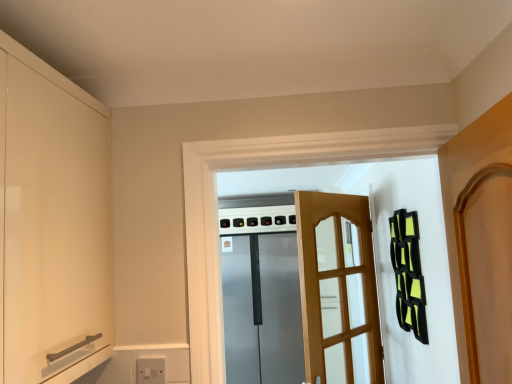
Where is `satin silver refrigerator at center, marked as the 1th screen door in a back-to-front arrangement`? The width and height of the screenshot is (512, 384). satin silver refrigerator at center, marked as the 1th screen door in a back-to-front arrangement is located at coordinates [x=262, y=310].

Locate an element on the screen. light brown wooden screen door at center, which is the second screen door from back to front is located at coordinates [343, 301].

Does matte white cabinet at left have a greater height compared to light brown wooden screen door at center, which is the second screen door from back to front?

No, matte white cabinet at left is not taller than light brown wooden screen door at center, which is the second screen door from back to front.

From the image's perspective, is matte white cabinet at left positioned above or below light brown wooden screen door at center, which is the second screen door from back to front?

Based on their image positions, matte white cabinet at left is located above light brown wooden screen door at center, which is the second screen door from back to front.

Considering the relative positions of matte white cabinet at left and light brown wooden screen door at center, which is the second screen door from back to front, in the image provided, is matte white cabinet at left to the right of light brown wooden screen door at center, which is the second screen door from back to front, from the viewer's perspective?

Incorrect, matte white cabinet at left is not on the right side of light brown wooden screen door at center, which is the second screen door from back to front.

Looking at this image, is matte white cabinet at left thinner than light brown wooden screen door at center, which is counted as the 1th screen door, starting from the front?

No.

How distant is satin silver refrigerator at center, the 2th screen door viewed from the front, from matte white cabinet at left?

A distance of 3.21 meters exists between satin silver refrigerator at center, the 2th screen door viewed from the front, and matte white cabinet at left.

Considering the points (257, 301) and (12, 179), which point is in front, point (257, 301) or point (12, 179)?

The point (12, 179) is closer to the camera.

Is satin silver refrigerator at center, marked as the 1th screen door in a back-to-front arrangement, not near matte white cabinet at left?

That's right, there is a large distance between satin silver refrigerator at center, marked as the 1th screen door in a back-to-front arrangement, and matte white cabinet at left.

Between satin silver refrigerator at center, marked as the 1th screen door in a back-to-front arrangement, and matte white cabinet at left, which one is positioned behind?

satin silver refrigerator at center, marked as the 1th screen door in a back-to-front arrangement, is further away from the camera.

Who is bigger, satin silver refrigerator at center, marked as the 1th screen door in a back-to-front arrangement, or light brown wooden screen door at center, which is counted as the 1th screen door, starting from the front?

satin silver refrigerator at center, marked as the 1th screen door in a back-to-front arrangement.

Which object is closer to the camera, satin silver refrigerator at center, the 2th screen door viewed from the front, or light brown wooden screen door at center, which is counted as the 1th screen door, starting from the front?

light brown wooden screen door at center, which is counted as the 1th screen door, starting from the front.

From the image's perspective, who appears lower, satin silver refrigerator at center, the 2th screen door viewed from the front, or light brown wooden screen door at center, which is counted as the 1th screen door, starting from the front?

satin silver refrigerator at center, the 2th screen door viewed from the front, from the image's perspective.

Considering the relative positions of light brown wooden screen door at center, which is counted as the 1th screen door, starting from the front, and matte white cabinet at left in the image provided, is light brown wooden screen door at center, which is counted as the 1th screen door, starting from the front, to the right of matte white cabinet at left from the viewer's perspective?

Indeed, light brown wooden screen door at center, which is counted as the 1th screen door, starting from the front, is positioned on the right side of matte white cabinet at left.

From the image's perspective, is light brown wooden screen door at center, which is counted as the 1th screen door, starting from the front, positioned above or below matte white cabinet at left?

From the image's perspective, light brown wooden screen door at center, which is counted as the 1th screen door, starting from the front, appears below matte white cabinet at left.

Measure the distance between light brown wooden screen door at center, which is the second screen door from back to front, and matte white cabinet at left.

light brown wooden screen door at center, which is the second screen door from back to front, is 5.10 feet from matte white cabinet at left.

Are light brown wooden screen door at center, which is the second screen door from back to front, and matte white cabinet at left located far from each other?

Indeed, light brown wooden screen door at center, which is the second screen door from back to front, is not near matte white cabinet at left.

Is light brown wooden screen door at center, which is counted as the 1th screen door, starting from the front, closer to the viewer compared to satin silver refrigerator at center, marked as the 1th screen door in a back-to-front arrangement?

Yes.

How much distance is there between light brown wooden screen door at center, which is the second screen door from back to front, and satin silver refrigerator at center, the 2th screen door viewed from the front?

The distance of light brown wooden screen door at center, which is the second screen door from back to front, from satin silver refrigerator at center, the 2th screen door viewed from the front, is 5.92 feet.

From the image's perspective, which one is positioned lower, light brown wooden screen door at center, which is the second screen door from back to front, or satin silver refrigerator at center, marked as the 1th screen door in a back-to-front arrangement?

satin silver refrigerator at center, marked as the 1th screen door in a back-to-front arrangement, from the image's perspective.

Is light brown wooden screen door at center, which is the second screen door from back to front, beside satin silver refrigerator at center, marked as the 1th screen door in a back-to-front arrangement?

No, light brown wooden screen door at center, which is the second screen door from back to front, is not next to satin silver refrigerator at center, marked as the 1th screen door in a back-to-front arrangement.

This screenshot has width=512, height=384. I want to click on cabinetry that appears on the left of satin silver refrigerator at center, the 2th screen door viewed from the front, so click(52, 223).

Considering the positions of objects matte white cabinet at left and satin silver refrigerator at center, marked as the 1th screen door in a back-to-front arrangement, in the image provided, who is more to the right, matte white cabinet at left or satin silver refrigerator at center, marked as the 1th screen door in a back-to-front arrangement,?

satin silver refrigerator at center, marked as the 1th screen door in a back-to-front arrangement.

Does matte white cabinet at left touch satin silver refrigerator at center, the 2th screen door viewed from the front?

matte white cabinet at left is not next to satin silver refrigerator at center, the 2th screen door viewed from the front, and they're not touching.

This screenshot has height=384, width=512. In the image, there is a light brown wooden screen door at center, which is the second screen door from back to front. In order to click on cabinetry above it (from the image's perspective) in this screenshot , I will do `click(52, 223)`.

Where is `cabinetry in front of the satin silver refrigerator at center, the 2th screen door viewed from the front`? This screenshot has height=384, width=512. cabinetry in front of the satin silver refrigerator at center, the 2th screen door viewed from the front is located at coordinates 52,223.

Which object lies further to the anchor point light brown wooden screen door at center, which is counted as the 1th screen door, starting from the front, satin silver refrigerator at center, the 2th screen door viewed from the front, or matte white cabinet at left?

satin silver refrigerator at center, the 2th screen door viewed from the front, lies further to light brown wooden screen door at center, which is counted as the 1th screen door, starting from the front, than the other object.

Looking at this image, looking at the image, which one is located closer to satin silver refrigerator at center, the 2th screen door viewed from the front, light brown wooden screen door at center, which is the second screen door from back to front, or matte white cabinet at left?

Based on the image, light brown wooden screen door at center, which is the second screen door from back to front, appears to be nearer to satin silver refrigerator at center, the 2th screen door viewed from the front.

In the scene shown: From the image, which object appears to be nearer to matte white cabinet at left, light brown wooden screen door at center, which is counted as the 1th screen door, starting from the front, or satin silver refrigerator at center, the 2th screen door viewed from the front?

light brown wooden screen door at center, which is counted as the 1th screen door, starting from the front, lies closer to matte white cabinet at left than the other object.

Considering their positions, is matte white cabinet at left positioned further to light brown wooden screen door at center, which is counted as the 1th screen door, starting from the front, than satin silver refrigerator at center, the 2th screen door viewed from the front?

satin silver refrigerator at center, the 2th screen door viewed from the front, lies further to light brown wooden screen door at center, which is counted as the 1th screen door, starting from the front, than the other object.

Based on their spatial positions, is satin silver refrigerator at center, the 2th screen door viewed from the front, or light brown wooden screen door at center, which is counted as the 1th screen door, starting from the front, further from matte white cabinet at left?

satin silver refrigerator at center, the 2th screen door viewed from the front.

Looking at the image, which one is located further to satin silver refrigerator at center, marked as the 1th screen door in a back-to-front arrangement, matte white cabinet at left or light brown wooden screen door at center, which is the second screen door from back to front?

Among the two, matte white cabinet at left is located further to satin silver refrigerator at center, marked as the 1th screen door in a back-to-front arrangement.

Identify the location of screen door between matte white cabinet at left and satin silver refrigerator at center, the 2th screen door viewed from the front, along the z-axis. (343, 301).